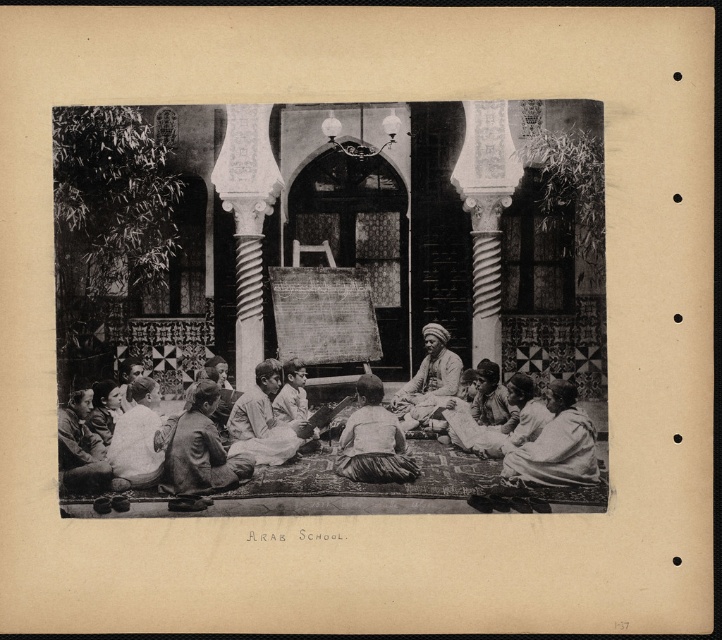
You are a historian examining this historical photograph of the ARAB SCHOOL. You notice two elements labeled as the smooth skin man at lower left and the smooth skin face at lower left. Based on their positions, which one is closer to the bottom edge of the image?

The smooth skin man at lower left is positioned under the smooth skin face at lower left, meaning the smooth skin face at lower left is closer to the bottom edge of the image.

You are an archaeologist examining this historical photograph. You notice two fabrics in the scene. The first is the light brown fabric at center, and the second is the light beige fabric at lower left. Based on their positions, which fabric is closer to you?

The light brown fabric at center is closer to you because it is in front of the light beige fabric at lower left.

You are a photographer who wants to capture a closeup of both the light brown fabric at center and the light beige fabric at lower left in the ARAB SCHOOL scene. Given that your camera can only focus on objects within a 40 feet range, will you be able to capture both fabrics in a single shot?

The light brown fabric at center and light beige fabric at lower left are 45.78 feet apart, which exceeds the camera focus range of 40 feet. Therefore, you cannot capture both fabrics in a single shot.